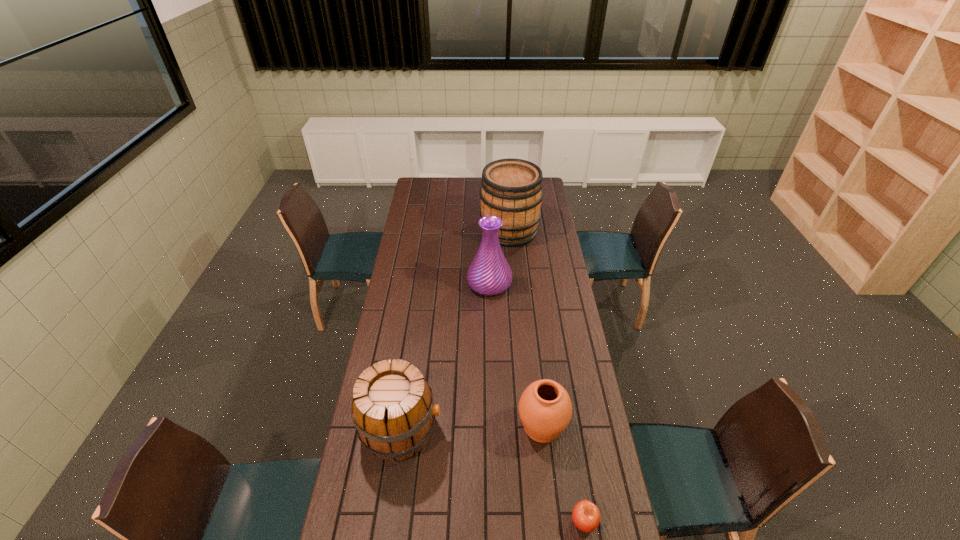
You are a GUI agent. You are given a task and a screenshot of the screen. Output one action in this format:
    pyautogui.click(x=<x>, y=<y>)
    Task: Click on the vacant space located on the side of the shorter cider where the spigot is located
    This screenshot has height=540, width=960.
    Given the screenshot: What is the action you would take?
    pyautogui.click(x=482, y=430)

Identify the location of free space located 0.180m on the front of the fourth tallest object. The width and height of the screenshot is (960, 540). (551, 507).

Identify the location of vacant space located 0.340m on the left of the apple. Image resolution: width=960 pixels, height=540 pixels. (456, 522).

The image size is (960, 540). In order to click on object that is positioned at the left edge in this screenshot , I will do `click(392, 407)`.

I want to click on cider at the right edge, so click(511, 189).

What are the coordinates of `urn positioned at the right edge` in the screenshot? It's located at (545, 409).

Where is `apple positioned at the right edge`? apple positioned at the right edge is located at coordinates (586, 516).

The width and height of the screenshot is (960, 540). In the image, there is a desktop. In order to click on blank space at the far edge in this screenshot , I will do `click(480, 188)`.

The image size is (960, 540). What are the coordinates of `vacant space at the left edge of the desktop` in the screenshot? It's located at (409, 327).

The width and height of the screenshot is (960, 540). In the image, there is a desktop. What are the coordinates of `vacant space at the right edge` in the screenshot? It's located at (561, 251).